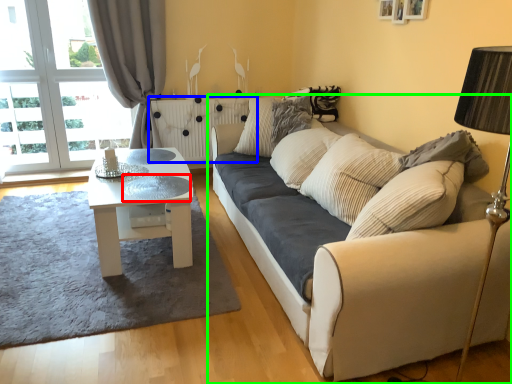
Question: Which object is the farthest from glass table (highlighted by a red box)? Choose among these: radiator (highlighted by a blue box) or studio couch (highlighted by a green box).

Choices:
 (A) radiator
 (B) studio couch

Answer: (A)